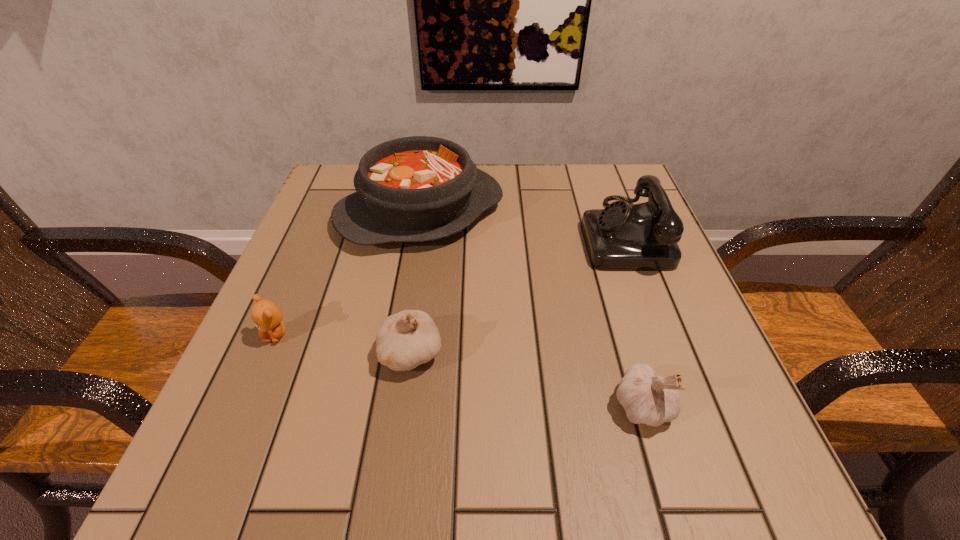
At what (x,y) coordinates should I click in order to perform the action: click on vacant area that lies between the teddy bear and the right garlic. Please return your answer as a coordinate pair (x, y). This screenshot has width=960, height=540. Looking at the image, I should click on (459, 370).

At what (x,y) coordinates should I click in order to perform the action: click on vacant space that's between the telephone and the left garlic. Please return your answer as a coordinate pair (x, y). This screenshot has width=960, height=540. Looking at the image, I should click on tap(516, 293).

You are a GUI agent. You are given a task and a screenshot of the screen. Output one action in this format:
    pyautogui.click(x=<x>, y=<y>)
    Task: Click on the vacant space that's between the left garlic and the telephone
    This screenshot has width=960, height=540.
    Given the screenshot: What is the action you would take?
    pyautogui.click(x=516, y=293)

Identify the location of blank region between the telephone and the casserole. (521, 222).

This screenshot has height=540, width=960. Identify the location of free space between the right garlic and the casserole. (532, 309).

Identify the location of free space that is in between the telephone and the right garlic. The image size is (960, 540). pos(633,319).

Where is `vacant area between the casserole and the right garlic`? This screenshot has height=540, width=960. vacant area between the casserole and the right garlic is located at coordinates (532, 309).

Identify the location of free space between the casserole and the left garlic. The width and height of the screenshot is (960, 540). (416, 282).

Identify which object is the third closest to the casserole. Please provide its 2D coordinates. Your answer should be formatted as a tuple, i.e. [(x, y)], where the tuple contains the x and y coordinates of a point satisfying the conditions above.

[(405, 340)]

You are a GUI agent. You are given a task and a screenshot of the screen. Output one action in this format:
    pyautogui.click(x=<x>, y=<y>)
    Task: Click on the fourth closest object to the leftmost object
    
    Given the screenshot: What is the action you would take?
    pyautogui.click(x=641, y=237)